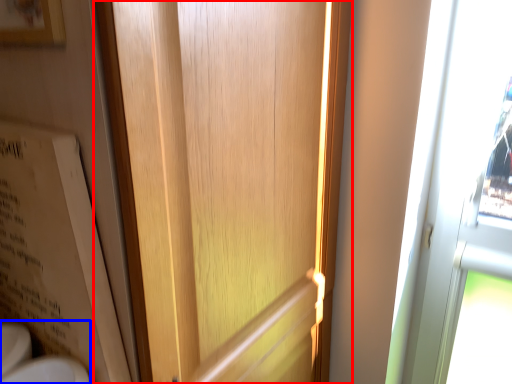
Question: Which of the following is the farthest to the observer, door (highlighted by a red box) or sink (highlighted by a blue box)?

Choices:
 (A) door
 (B) sink

Answer: (B)